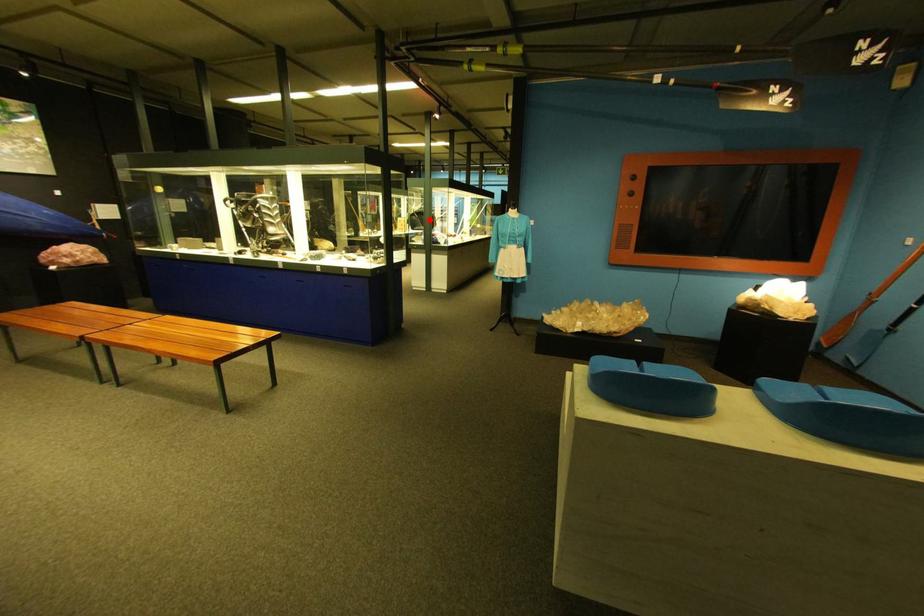
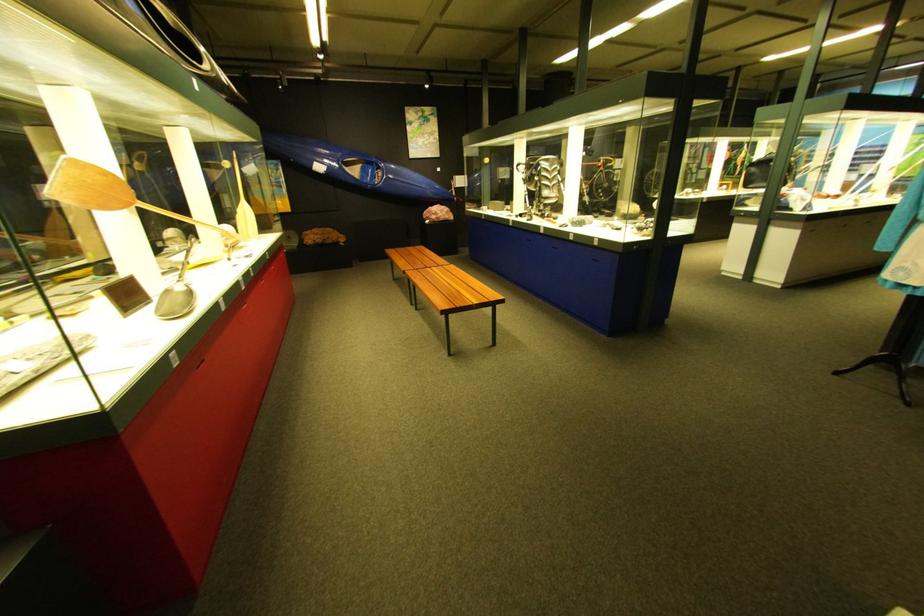
Question: I am providing you with two images of the same scene from different viewpoints. Image1 has a red point marked. In image2, the corresponding 3D location appears at what relative position? Reply with the corresponding letter.

Choices:
 (A) Closer
 (B) Farther

Answer: (B)